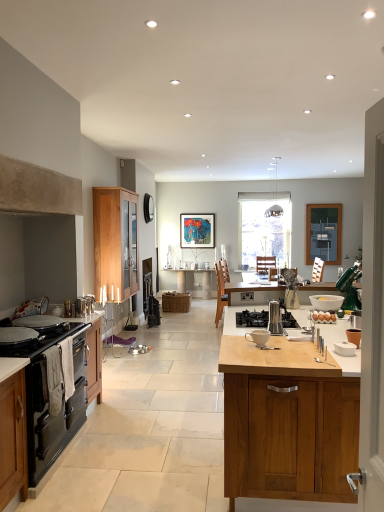
Locate an element on the screen. free space to the right of black matte oven at left, acting as the second cabinetry starting from the back is located at coordinates (124, 455).